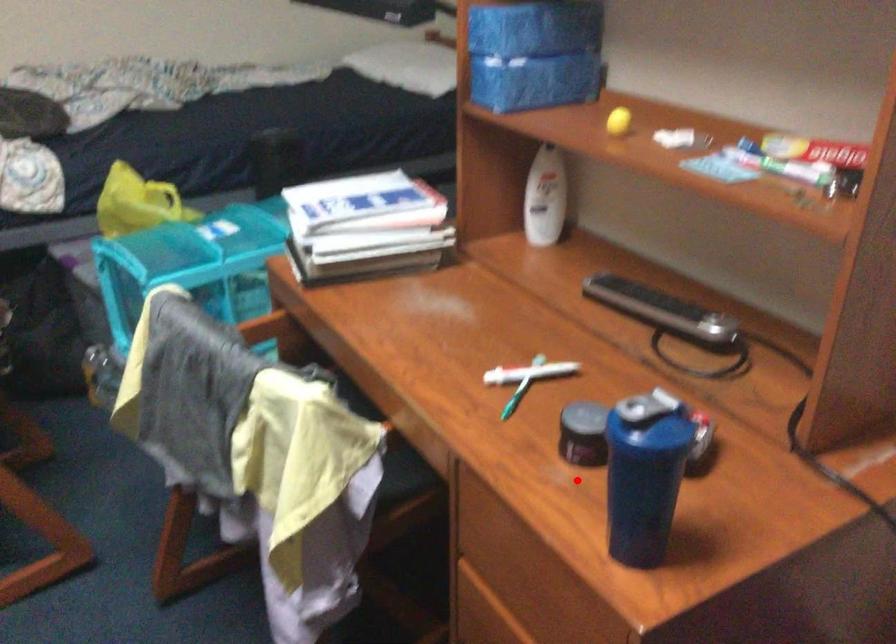
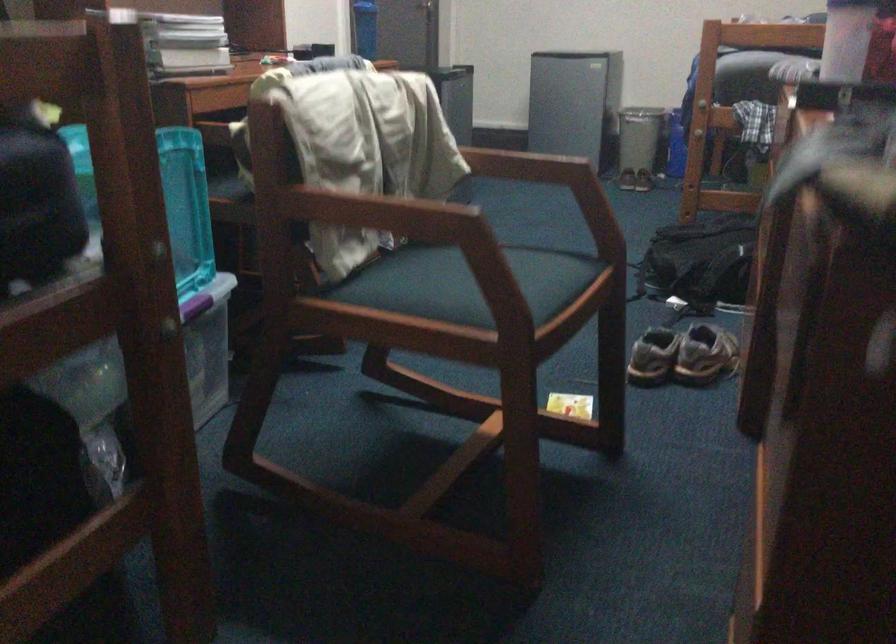
Question: I am providing you with two images of the same scene from different viewpoints. Image1 has a red point marked. In image2, the corresponding 3D location appears at what relative position? Reply with the corresponding letter.

Choices:
 (A) Closer
 (B) Farther

Answer: (B)